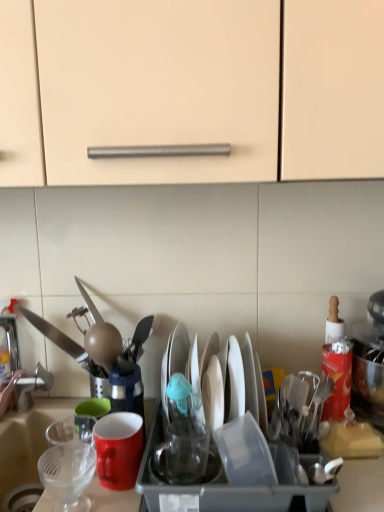
Question: Can you confirm if matte red mug at center is smaller than transparent plastic cup at center, which appears as the first tableware when viewed from the right?

Choices:
 (A) no
 (B) yes

Answer: (A)

Question: Would you say transparent plastic cup at center, which appears as the first tableware when viewed from the right, is part of matte red mug at center's contents?

Choices:
 (A) yes
 (B) no

Answer: (B)

Question: Considering the relative sizes of matte red mug at center and transparent plastic cup at center, acting as the 2th tableware starting from the left, in the image provided, is matte red mug at center wider than transparent plastic cup at center, acting as the 2th tableware starting from the left,?

Choices:
 (A) yes
 (B) no

Answer: (A)

Question: Can you confirm if matte red mug at center is shorter than transparent plastic cup at center, which appears as the first tableware when viewed from the right?

Choices:
 (A) no
 (B) yes

Answer: (A)

Question: Could you tell me if matte red mug at center is turned towards transparent plastic cup at center, which appears as the first tableware when viewed from the right?

Choices:
 (A) yes
 (B) no

Answer: (B)

Question: Can you confirm if matte red mug at center is taller than transparent plastic cup at center, which appears as the first tableware when viewed from the right?

Choices:
 (A) yes
 (B) no

Answer: (A)

Question: Is transparent plastic sink at lower left directly adjacent to white paper at right?

Choices:
 (A) yes
 (B) no

Answer: (B)

Question: Is transparent plastic sink at lower left not inside white paper at right?

Choices:
 (A) no
 (B) yes

Answer: (B)

Question: Is transparent plastic sink at lower left not close to white paper at right?

Choices:
 (A) yes
 (B) no

Answer: (B)

Question: Is transparent plastic sink at lower left at the left side of white paper at right?

Choices:
 (A) yes
 (B) no

Answer: (A)

Question: From a real-world perspective, is transparent plastic sink at lower left positioned over white paper at right based on gravity?

Choices:
 (A) no
 (B) yes

Answer: (A)

Question: Is transparent plastic sink at lower left wider than white paper at right?

Choices:
 (A) yes
 (B) no

Answer: (A)

Question: Does matte red mug at center have a larger size compared to clear plastic strainer at lower left, acting as the second tableware starting from the right?

Choices:
 (A) yes
 (B) no

Answer: (A)